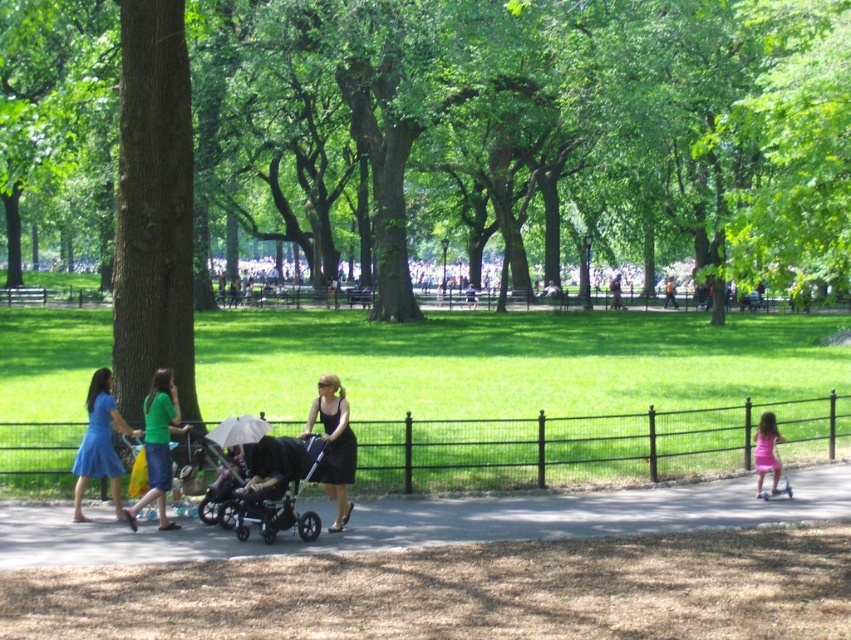
Who is more forward, (349,458) or (775,420)?

Point (349,458)

Is black satin dress at center bigger than pink satin dress at lower right?

Yes, black satin dress at center is bigger than pink satin dress at lower right.

The height and width of the screenshot is (640, 851). Identify the location of black satin dress at center. (334, 444).

Between matte blue dress at left and pink satin dress at lower right, which one has less height?

pink satin dress at lower right

Consider the image. Is matte blue dress at left shorter than pink satin dress at lower right?

Incorrect, matte blue dress at left's height does not fall short of pink satin dress at lower right's.

Is point (87, 435) farther from viewer compared to point (761, 424)?

No, it is not.

What are the coordinates of `matte blue dress at left` in the screenshot? It's located at (100, 444).

Where is `black fabric stroller at center`? This screenshot has width=851, height=640. black fabric stroller at center is located at coordinates (271, 486).

Between black fabric stroller at center and matte blue dress at left, which one is positioned lower?

Positioned lower is black fabric stroller at center.

Is point (298, 440) closer to viewer compared to point (89, 470)?

Yes, point (298, 440) is closer to viewer.

Image resolution: width=851 pixels, height=640 pixels. Identify the location of black fabric stroller at center. (271, 486).